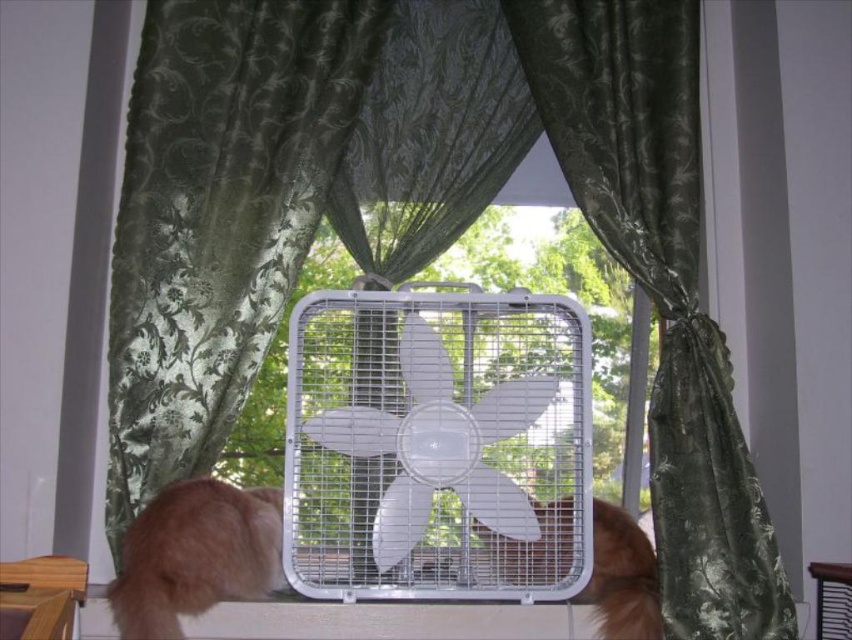
You are a cat owner who wants to ensure your brown furry cat at center has enough space to move freely between the green satin curtain at center and the windowsill. Given the curtain is wider than the cat, can the cat comfortably move around without obstruction?

The green satin curtain at center is wider than the brown furry cat at center, providing sufficient space for the cat to move around comfortably between the curtain and the windowsill without obstruction.

You are a delivery person who just arrived at a house. You see a window with curtains and a fan. There is also a fluffy orange fur at lower left. Where exactly is the fluffy orange fur located in relation to the window and the fan?

The fluffy orange fur at lower left is located at point (194, 556), which is to the lower left of the window and fan.

You are a photographer trying to capture a clear photo of the brown furry cat at center. However, the green satin curtain at center is blocking your view. Can you move the curtain to get a clear shot?

The green satin curtain at center is closer to the viewer than the brown furry cat at center, so moving the curtain would allow you to see the brown furry cat at center clearly.